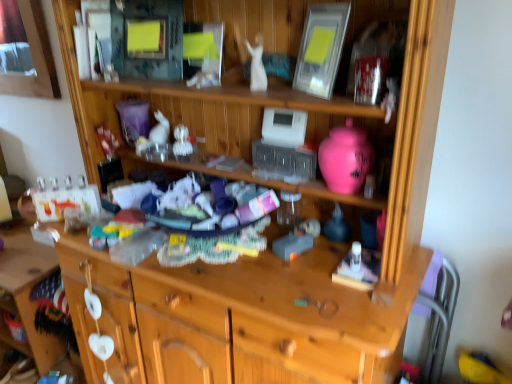
Question: Is matte silver picture frame at upper center wider or thinner than white glossy statue at center, the 2th toy from the front?

Choices:
 (A) thin
 (B) wide

Answer: (B)

Question: From their relative heights in the image, would you say matte silver picture frame at upper center is taller or shorter than white glossy statue at center, arranged as the 3th toy when viewed from the left?

Choices:
 (A) tall
 (B) short

Answer: (A)

Question: Which object is positioned farthest from the white matte rabbit at center, which is the first toy in back-to-front order?

Choices:
 (A) white glossy statue at center, the 3th toy positioned from the back
 (B) purple fabric chair at right
 (C) clear plastic ornaments at center, arranged as the second toy when viewed from the left
 (D) matte silver picture frame at upper center
 (E) pink glossy vase at upper right, which is the fourth toy in back-to-front order

Answer: (B)

Question: Considering the real-world distances, which object is closest to the clear plastic ornaments at center, arranged as the second toy when viewed from the left?

Choices:
 (A) white glossy statue at center, acting as the second toy starting from the right
 (B) matte silver picture frame at upper center
 (C) purple fabric chair at right
 (D) pink glossy vase at upper right, which is the fourth toy in back-to-front order
 (E) white matte rabbit at center, the 4th toy positioned from the right

Answer: (E)